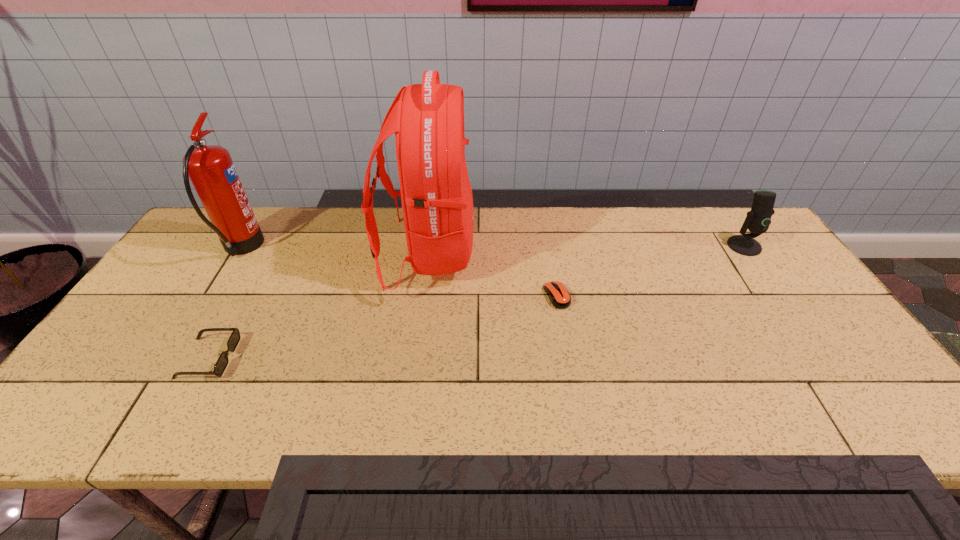
Where is `object that is positioned at the far right corner`? This screenshot has width=960, height=540. object that is positioned at the far right corner is located at coordinates (757, 221).

Identify the location of vacant space at the far edge. This screenshot has width=960, height=540. (526, 252).

Image resolution: width=960 pixels, height=540 pixels. In order to click on vacant area at the near edge of the desktop in this screenshot , I will do `click(708, 414)`.

In the image, there is a desktop. Where is `vacant space at the left edge`? This screenshot has width=960, height=540. vacant space at the left edge is located at coordinates (116, 369).

The height and width of the screenshot is (540, 960). In order to click on vacant space at the far right corner of the desktop in this screenshot , I will do `click(713, 218)`.

I want to click on vacant space at the near right corner, so click(x=835, y=418).

The height and width of the screenshot is (540, 960). Identify the location of free space between the microphone and the fourth tallest object. (476, 302).

The height and width of the screenshot is (540, 960). Identify the location of vacant space that's between the fourth shortest object and the sunglasses. (225, 303).

Image resolution: width=960 pixels, height=540 pixels. I want to click on vacant point located between the fire extinguisher and the rightmost object, so click(x=492, y=247).

Locate an element on the screen. blank region between the third object from right to left and the computer mouse is located at coordinates (492, 274).